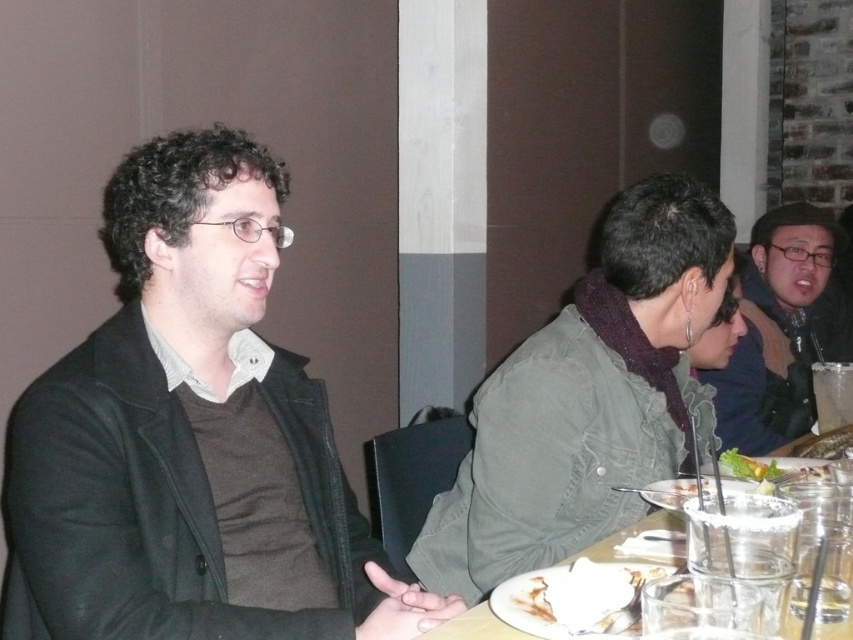
You are a server in a restaurant. You need to deliver a dessert plate to the wooden table at center. The dessert plate is 12 inches in diameter. Can you place it on the table without it overlapping the matte black jacket at left?

The distance between the matte black jacket at left and the wooden table at center is 24.18 inches. Since the dessert plate is only 12 inches wide, there is enough space to place it on the table without overlapping the jacket.

You are a photographer trying to capture a candid shot of the matte black jacket at left and the wooden table at center. Since you want to ensure both are in focus, you need to know which object is taller. Which one is taller?

The matte black jacket at left is taller than the wooden table at center according to the description.

You are a photographer trying to capture a closeup of the green leafy vegetable at center. However, the dark green jacket at center is blocking your view. Can you move the jacket to get a clear shot?

The dark green jacket at center is located above the green leafy vegetable at center, so moving the jacket would allow you to see the vegetable clearly.